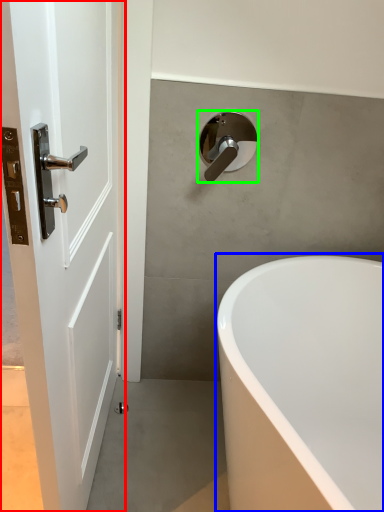
Question: Which is farther away from door (highlighted by a red box)? bathtub (highlighted by a blue box) or tap (highlighted by a green box)?

Choices:
 (A) bathtub
 (B) tap

Answer: (B)